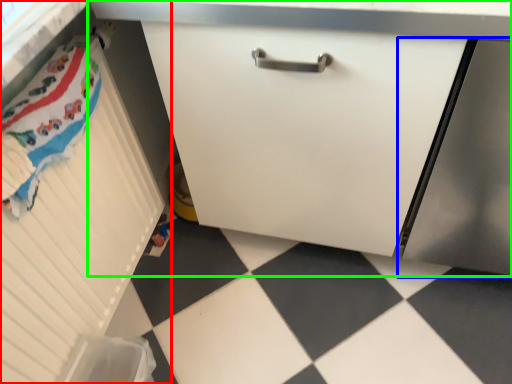
Question: Considering the real-world distances, which object is farthest from cabinetry (highlighted by a red box)? screen door (highlighted by a blue box) or cabinetry (highlighted by a green box)?

Choices:
 (A) screen door
 (B) cabinetry

Answer: (A)